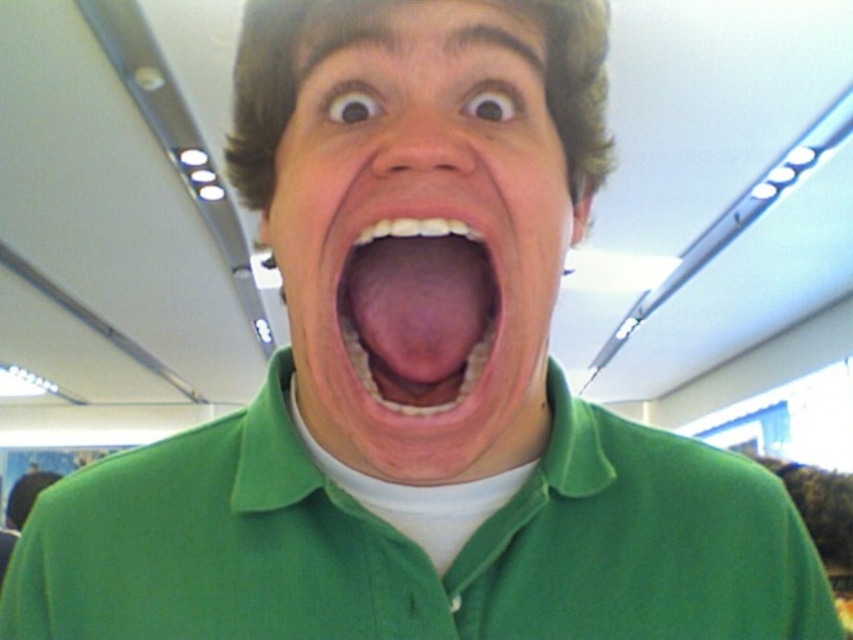
Question: Is green matte face at center thinner than pink flesh-colored tongue at center?

Choices:
 (A) no
 (B) yes

Answer: (A)

Question: Which of the following is the closest to the observer?

Choices:
 (A) pink flesh-colored tongue at center
 (B) green matte polo shirt at center

Answer: (A)

Question: Does pink flesh-colored tongue at center lie behind green matte polo shirt at center?

Choices:
 (A) no
 (B) yes

Answer: (A)

Question: Estimate the real-world distances between objects in this image. Which object is closer to the green matte face at center?

Choices:
 (A) pink flesh-colored tongue at center
 (B) green matte polo shirt at center

Answer: (A)

Question: Which of the following is the closest to the observer?

Choices:
 (A) (474, 365)
 (B) (312, 65)
 (C) (440, 561)

Answer: (A)

Question: Can you confirm if pink flesh-colored tongue at center is bigger than green matte polo shirt at center?

Choices:
 (A) no
 (B) yes

Answer: (A)